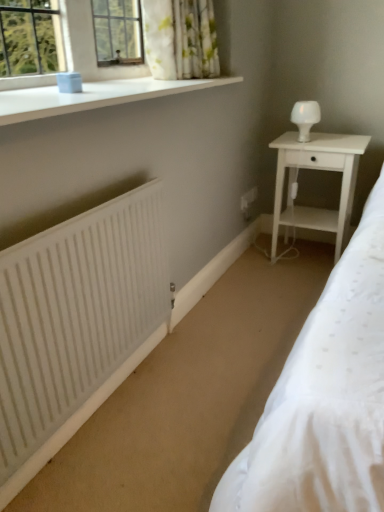
Where is `white smooth window sill at upper left`? white smooth window sill at upper left is located at coordinates (93, 96).

Does point (25, 321) appear closer or farther from the camera than point (282, 155)?

Clearly, point (25, 321) is closer to the camera than point (282, 155).

Which is in front, white matte radiator at lower left or white wood nightstand at right?

white matte radiator at lower left is more forward.

This screenshot has height=512, width=384. I want to click on radiator above the white wood nightstand at right (from a real-world perspective), so (75, 317).

Between white matte radiator at lower left and white wood nightstand at right, which one appears on the right side from the viewer's perspective?

white wood nightstand at right.

Is white glossy table lamp at upper right positioned with its back to white smooth window sill at upper left?

No, white glossy table lamp at upper right is not facing away from white smooth window sill at upper left.

Which of these two, white glossy table lamp at upper right or white smooth window sill at upper left, stands shorter?

Standing shorter between the two is white smooth window sill at upper left.

Is white glossy table lamp at upper right touching white smooth window sill at upper left?

There is a gap between white glossy table lamp at upper right and white smooth window sill at upper left.

This screenshot has height=512, width=384. I want to click on nightstand below the white glossy table lamp at upper right (from the image's perspective), so click(x=317, y=169).

Does white glossy table lamp at upper right touch white wood nightstand at right?

No, white glossy table lamp at upper right is not beside white wood nightstand at right.

How different are the orientations of white glossy table lamp at upper right and white wood nightstand at right in degrees?

white glossy table lamp at upper right and white wood nightstand at right are facing 0.391 degrees away from each other.

Considering the relative sizes of white glossy table lamp at upper right and white wood nightstand at right in the image provided, is white glossy table lamp at upper right wider than white wood nightstand at right?

No, white glossy table lamp at upper right is not wider than white wood nightstand at right.

Between white wood nightstand at right and white smooth window sill at upper left, which one has larger size?

With larger size is white wood nightstand at right.

Is white wood nightstand at right aimed at white smooth window sill at upper left?

No.

From a real-world perspective, between white wood nightstand at right and white smooth window sill at upper left, who is vertically higher?

white smooth window sill at upper left.

Is point (281, 159) positioned in front of point (49, 97)?

No, (281, 159) is behind (49, 97).

Looking at this image, from the image's perspective, is white matte radiator at lower left beneath white smooth window sill at upper left?

Indeed, from the image's perspective, white matte radiator at lower left is shown beneath white smooth window sill at upper left.

Does white matte radiator at lower left lie in front of white smooth window sill at upper left?

Yes, it is in front of white smooth window sill at upper left.

From a real-world perspective, who is located higher, white matte radiator at lower left or white smooth window sill at upper left?

white smooth window sill at upper left is physically above.

Looking at this image, is white matte radiator at lower left with white glossy table lamp at upper right?

No, white matte radiator at lower left is not touching white glossy table lamp at upper right.

Which object is more forward, white matte radiator at lower left or white glossy table lamp at upper right?

white matte radiator at lower left is closer to the camera.

Where is `radiator that is in front of the white glossy table lamp at upper right`? The width and height of the screenshot is (384, 512). radiator that is in front of the white glossy table lamp at upper right is located at coordinates (75, 317).

Is white matte radiator at lower left oriented away from white glossy table lamp at upper right?

No, white matte radiator at lower left is not facing away from white glossy table lamp at upper right.

Is white smooth window sill at upper left further to camera compared to white glossy table lamp at upper right?

No, the depth of white smooth window sill at upper left is less than that of white glossy table lamp at upper right.

How many degrees apart are the facing directions of white smooth window sill at upper left and white glossy table lamp at upper right?

There is a 89.2-degree angle between the facing directions of white smooth window sill at upper left and white glossy table lamp at upper right.

Is white smooth window sill at upper left positioned far away from white glossy table lamp at upper right?

No, white smooth window sill at upper left is in close proximity to white glossy table lamp at upper right.

Based on the photo, is white smooth window sill at upper left completely or partially outside of white glossy table lamp at upper right?

That's correct, white smooth window sill at upper left is outside of white glossy table lamp at upper right.

Locate an element on the screen. The image size is (384, 512). radiator located above the white wood nightstand at right (from a real-world perspective) is located at coordinates (75, 317).

In the image, there is a white smooth window sill at upper left. Where is `table lamp below it (from a real-world perspective)`? This screenshot has width=384, height=512. table lamp below it (from a real-world perspective) is located at coordinates (305, 117).

From the image, which object appears to be nearer to white glossy table lamp at upper right, white wood nightstand at right or white smooth window sill at upper left?

Among the two, white wood nightstand at right is located nearer to white glossy table lamp at upper right.

Which object lies further to the anchor point white matte radiator at lower left, white wood nightstand at right or white smooth window sill at upper left?

white wood nightstand at right is positioned further to the anchor white matte radiator at lower left.

Looking at the image, which one is located closer to white glossy table lamp at upper right, white matte radiator at lower left or white smooth window sill at upper left?

Among the two, white smooth window sill at upper left is located nearer to white glossy table lamp at upper right.

In the scene shown: Looking at the image, which one is located further to white matte radiator at lower left, white glossy table lamp at upper right or white smooth window sill at upper left?

Among the two, white glossy table lamp at upper right is located further to white matte radiator at lower left.

From the image, which object appears to be nearer to white wood nightstand at right, white smooth window sill at upper left or white matte radiator at lower left?

Among the two, white smooth window sill at upper left is located nearer to white wood nightstand at right.

Based on the photo, looking at the image, which one is located further to white smooth window sill at upper left, white matte radiator at lower left or white wood nightstand at right?

white wood nightstand at right is positioned further to the anchor white smooth window sill at upper left.

Considering their positions, is white glossy table lamp at upper right positioned further to white smooth window sill at upper left than white matte radiator at lower left?

white glossy table lamp at upper right is positioned further to the anchor white smooth window sill at upper left.

Estimate the real-world distances between objects in this image. Which object is closer to white wood nightstand at right, white glossy table lamp at upper right or white matte radiator at lower left?

white glossy table lamp at upper right lies closer to white wood nightstand at right than the other object.

Identify the location of nightstand between white smooth window sill at upper left and white glossy table lamp at upper right in the front-back direction. This screenshot has height=512, width=384. (317, 169).

Find the location of a particular element. The width and height of the screenshot is (384, 512). window sill between white matte radiator at lower left and white glossy table lamp at upper right in the front-back direction is located at coordinates (93, 96).

Where is `window sill located between white matte radiator at lower left and white wood nightstand at right in the depth direction`? This screenshot has height=512, width=384. window sill located between white matte radiator at lower left and white wood nightstand at right in the depth direction is located at coordinates (93, 96).

Find the location of a particular element. Image resolution: width=384 pixels, height=512 pixels. nightstand between white matte radiator at lower left and white glossy table lamp at upper right from front to back is located at coordinates (317, 169).